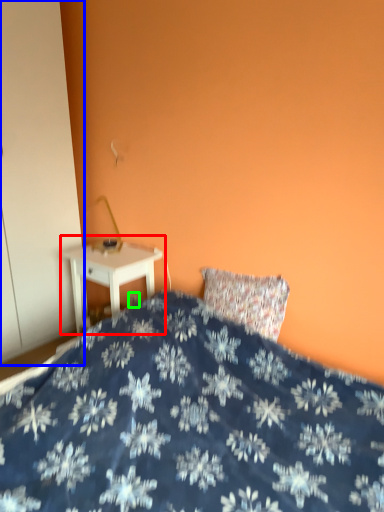
Question: Based on their relative distances, which object is farther from nightstand (highlighted by a red box)? Choose from armoire (highlighted by a blue box) and electric outlet (highlighted by a green box).

Choices:
 (A) armoire
 (B) electric outlet

Answer: (A)